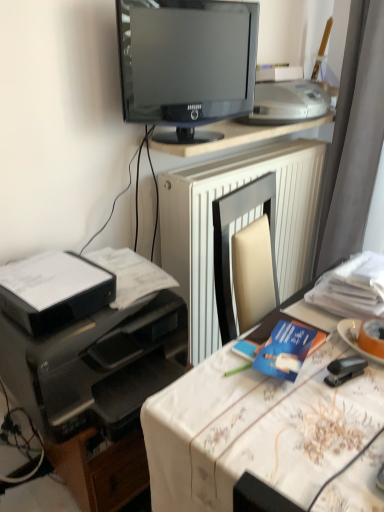
Question: From the image's perspective, is black plastic stapler at lower right under black plastic printer at left, the 1th printer in the bottom-to-top sequence?

Choices:
 (A) yes
 (B) no

Answer: (B)

Question: Is black plastic stapler at lower right aimed at black plastic printer at left, arranged as the third printer when viewed from the top?

Choices:
 (A) no
 (B) yes

Answer: (A)

Question: Can you confirm if black plastic stapler at lower right is smaller than black plastic printer at left, arranged as the third printer when viewed from the top?

Choices:
 (A) yes
 (B) no

Answer: (A)

Question: From the image's perspective, is black plastic stapler at lower right on top of black plastic printer at left, arranged as the third printer when viewed from the top?

Choices:
 (A) yes
 (B) no

Answer: (A)

Question: Does black plastic stapler at lower right lie behind black plastic printer at left, the 1th printer in the bottom-to-top sequence?

Choices:
 (A) yes
 (B) no

Answer: (A)

Question: Is black plastic stapler at lower right bigger than black plastic printer at left, arranged as the third printer when viewed from the top?

Choices:
 (A) no
 (B) yes

Answer: (A)

Question: Considering the relative sizes of orange matte plate at right and blue paper at center in the image provided, is orange matte plate at right smaller than blue paper at center?

Choices:
 (A) no
 (B) yes

Answer: (B)

Question: From the image's perspective, is orange matte plate at right located above blue paper at center?

Choices:
 (A) yes
 (B) no

Answer: (A)

Question: Is blue paper at center completely or partially inside orange matte plate at right?

Choices:
 (A) no
 (B) yes

Answer: (A)

Question: Is orange matte plate at right facing away from blue paper at center?

Choices:
 (A) yes
 (B) no

Answer: (B)

Question: From a real-world perspective, is orange matte plate at right positioned under blue paper at center based on gravity?

Choices:
 (A) no
 (B) yes

Answer: (A)

Question: Considering the relative sizes of orange matte plate at right and blue paper at center in the image provided, is orange matte plate at right shorter than blue paper at center?

Choices:
 (A) yes
 (B) no

Answer: (B)

Question: Is black plastic printer at left, arranged as the third printer when viewed from the top, bigger than black plastic printer at lower left, which is the 2th printer from top to bottom?

Choices:
 (A) yes
 (B) no

Answer: (A)